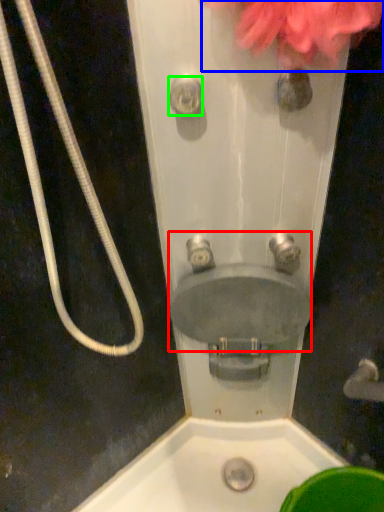
Question: Based on their relative distances, which object is farther from sink (highlighted by a red box)? Choose from flower (highlighted by a blue box) and shower (highlighted by a green box).

Choices:
 (A) flower
 (B) shower

Answer: (A)